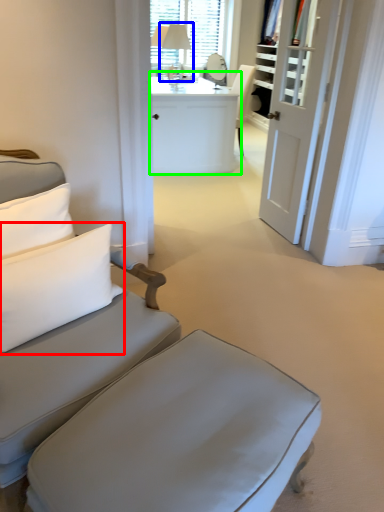
Question: Considering the real-world distances, which object is closest to pillow (highlighted by a red box)? table lamp (highlighted by a blue box) or desk (highlighted by a green box).

Choices:
 (A) table lamp
 (B) desk

Answer: (B)